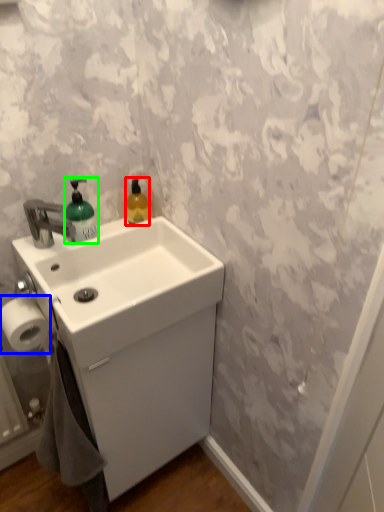
Question: Which object is the farthest from cleaning product (highlighted by a red box)? Choose among these: toilet paper (highlighted by a blue box) or soap dispenser (highlighted by a green box).

Choices:
 (A) toilet paper
 (B) soap dispenser

Answer: (A)